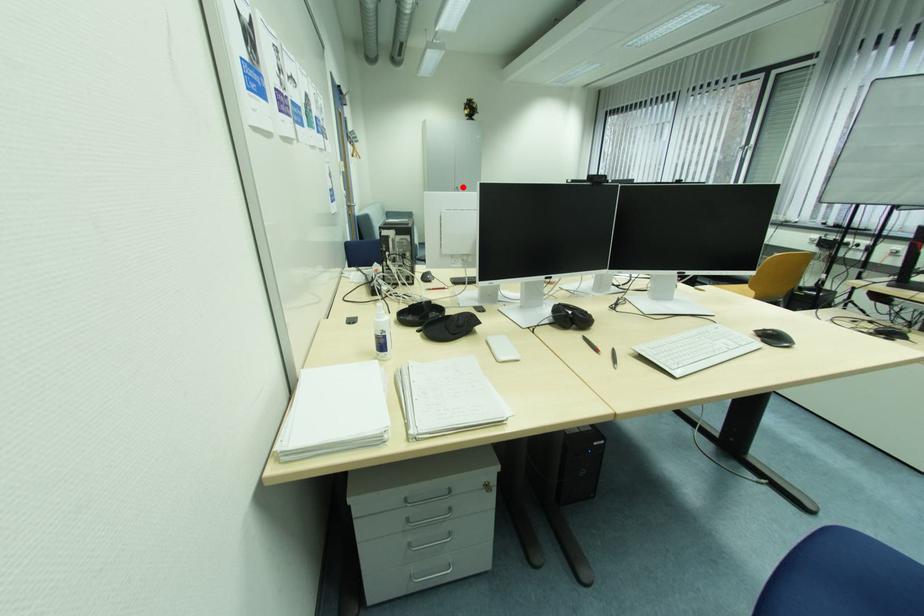
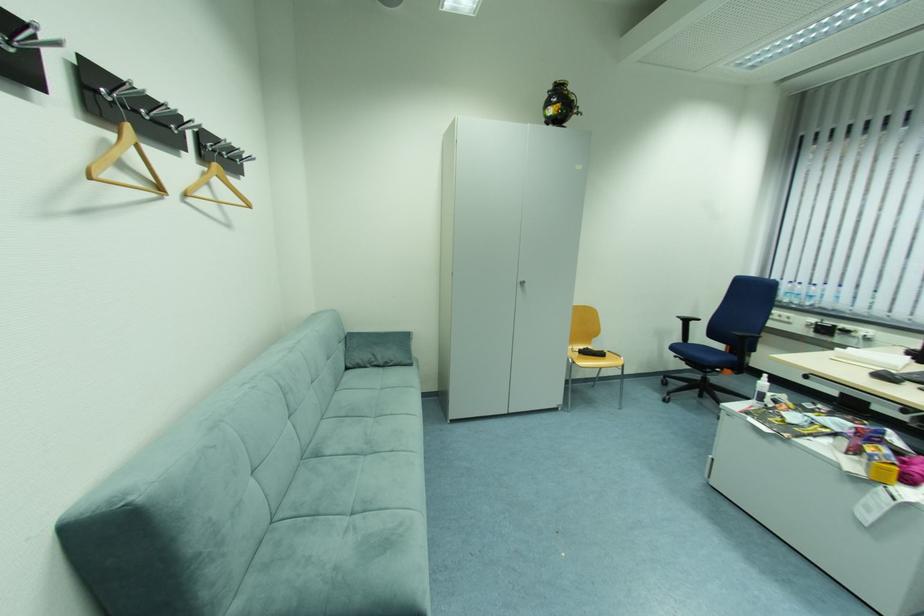
The point at the highlighted location is marked in the first image. Where is the corresponding point in the second image?

(527, 281)